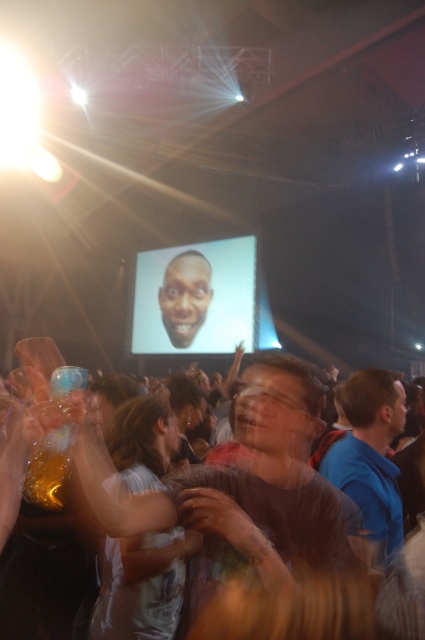
Is white cotton shirt at center above blue fabric shirt at right?

Incorrect, white cotton shirt at center is not positioned above blue fabric shirt at right.

Which is behind, point (129, 540) or point (376, 515)?

Point (376, 515)

The width and height of the screenshot is (425, 640). What are the coordinates of `white cotton shirt at center` in the screenshot? It's located at (141, 586).

Between white cotton shirt at center and matte plastic screen at center, which one has less height?

Standing shorter between the two is white cotton shirt at center.

Does white cotton shirt at center have a smaller size compared to matte plastic screen at center?

Yes.

What do you see at coordinates (141, 586) in the screenshot? I see `white cotton shirt at center` at bounding box center [141, 586].

The width and height of the screenshot is (425, 640). I want to click on white cotton shirt at center, so (141, 586).

Describe the element at coordinates (241, 513) in the screenshot. I see `translucent plastic bag at center` at that location.

Can you confirm if translucent plastic bag at center is smaller than white cotton shirt at center?

No.

The height and width of the screenshot is (640, 425). Describe the element at coordinates (241, 513) in the screenshot. I see `translucent plastic bag at center` at that location.

At what (x,y) coordinates should I click in order to perform the action: click on translucent plastic bag at center. Please return your answer as a coordinate pair (x, y). This screenshot has width=425, height=640. Looking at the image, I should click on (241, 513).